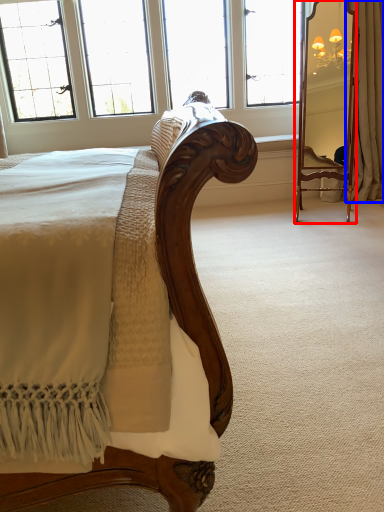
Question: Which point is further to the camera, mirror (highlighted by a red box) or curtain (highlighted by a blue box)?

Choices:
 (A) mirror
 (B) curtain

Answer: (B)